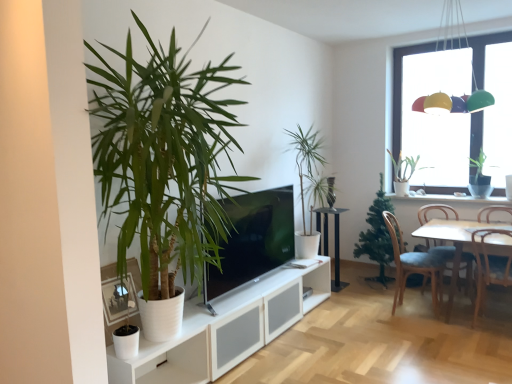
Question: In the image, is matte black tv at center positioned in front of or behind brown wooden chair at right, the fourth chair positioned from the left?

Choices:
 (A) behind
 (B) front

Answer: (B)

Question: From a real-world perspective, is matte black tv at center positioned above or below brown wooden chair at right, the fourth chair positioned from the left?

Choices:
 (A) below
 (B) above

Answer: (B)

Question: Estimate the real-world distances between objects in this image. Which object is farther from the white wooden table at right, which is the 1th table in front-to-back order?

Choices:
 (A) green leafy plant at center, acting as the 2th houseplant starting from the front
 (B) black metal table at center, which appears as the 2th table when viewed from the front
 (C) multicolored plastic lampshade at upper right
 (D) green leafy plant at left, the first houseplant when ordered from front to back
 (E) wooden chair at right, which is the second chair from left to right

Answer: (D)

Question: Estimate the real-world distances between objects in this image. Which object is farther from the black metal table at center, which is the first table in left-to-right order?

Choices:
 (A) multicolored plastic lampshade at upper right
 (B) wooden chair at right, acting as the third chair starting from the right
 (C) green matte plant at upper right, placed as the 3th houseplant when sorted from front to back
 (D) matte black tv at center
 (E) green leafy plant at left, positioned as the fifth houseplant in back-to-front order

Answer: (E)